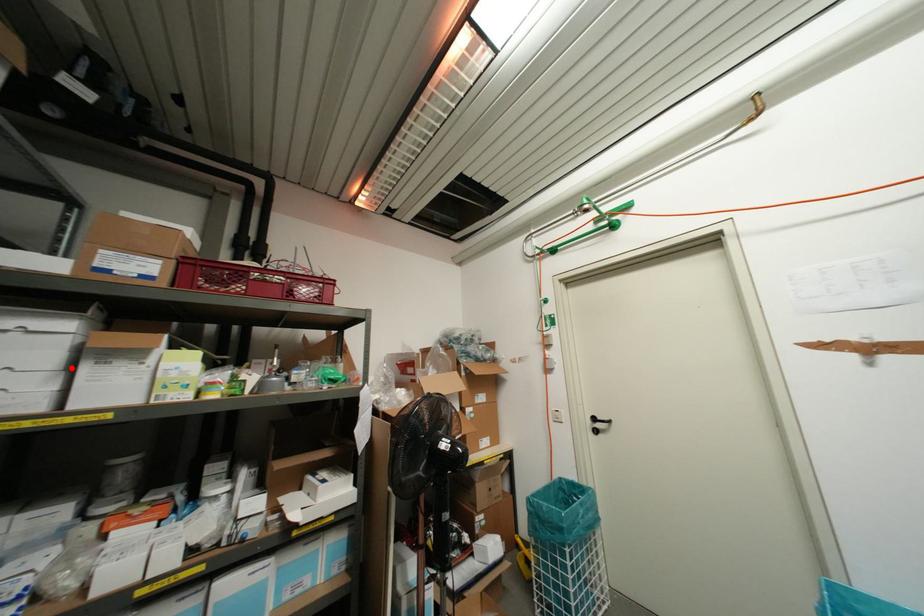
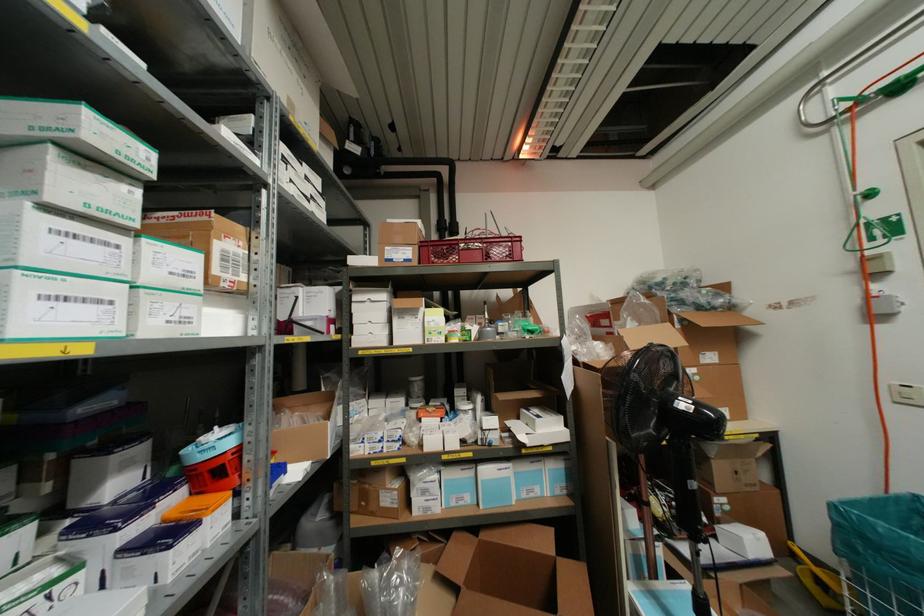
Where in the second image is the point corresponding to the highlighted location from the first image?

(390, 321)